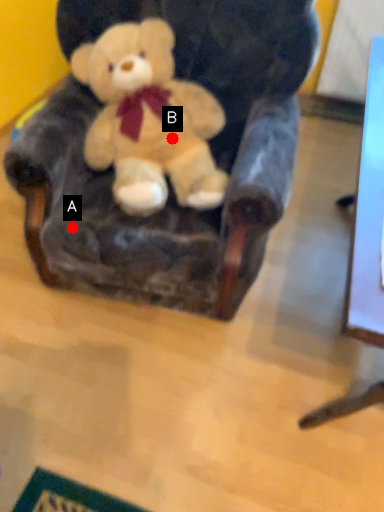
Question: Two points are circled on the image, labeled by A and B beside each circle. Which point is farther to the camera?

Choices:
 (A) A is further
 (B) B is further

Answer: (B)